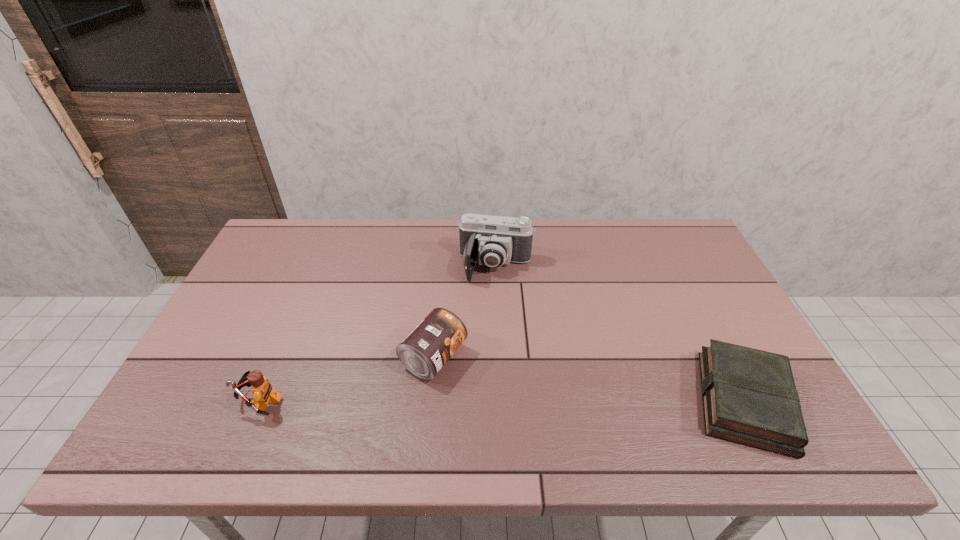
Where is `object present at the left edge`? This screenshot has width=960, height=540. object present at the left edge is located at coordinates (262, 390).

This screenshot has height=540, width=960. Find the location of `object situated at the right edge`. object situated at the right edge is located at coordinates (749, 396).

Locate an element on the screen. Image resolution: width=960 pixels, height=540 pixels. object at the near left corner is located at coordinates (262, 390).

Where is `object that is at the near right corner`? object that is at the near right corner is located at coordinates (749, 396).

Identify the location of vacant space at the far edge. The width and height of the screenshot is (960, 540). (431, 225).

This screenshot has width=960, height=540. I want to click on vacant space at the near edge, so click(575, 388).

I want to click on free location at the left edge of the desktop, so click(x=200, y=355).

Locate an element on the screen. This screenshot has width=960, height=540. vacant area at the far right corner is located at coordinates (663, 257).

Locate an element on the screen. free space between the tallest object and the leftmost object is located at coordinates (378, 334).

Identify the location of free space between the Lego and the can. (348, 379).